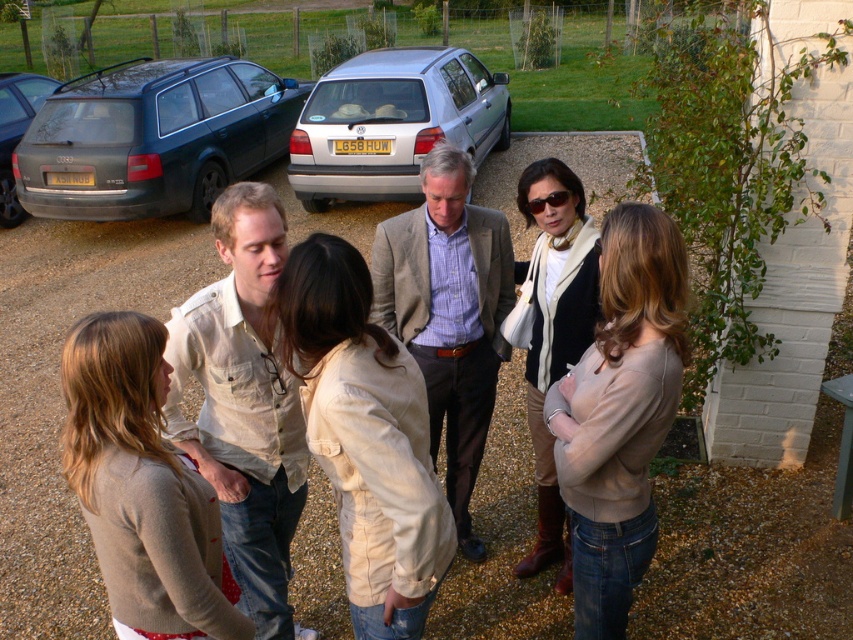
Is the position of beige cotton jacket at center less distant than that of light beige shirt at center?

That is True.

Between beige cotton jacket at center and light beige shirt at center, which one appears on the right side from the viewer's perspective?

beige cotton jacket at center is more to the right.

What do you see at coordinates (364, 436) in the screenshot?
I see `beige cotton jacket at center` at bounding box center [364, 436].

The width and height of the screenshot is (853, 640). Identify the location of beige cotton jacket at center. (364, 436).

Does beige cotton shirt at center have a greater width compared to matte beige sweater at center?

Yes.

Who is more distant from viewer, (552, 566) or (630, 593)?

The point (552, 566) is more distant.

Identify the location of beige cotton shirt at center. (502, 538).

Looking at this image, is the position of light beige shirt at center less distant than that of brown textured blazer at center?

Yes, light beige shirt at center is in front of brown textured blazer at center.

The width and height of the screenshot is (853, 640). What do you see at coordinates (244, 404) in the screenshot? I see `light beige shirt at center` at bounding box center [244, 404].

Between point (178, 387) and point (447, 484), which one is positioned behind?

The point (447, 484) is behind.

I want to click on light beige shirt at center, so click(244, 404).